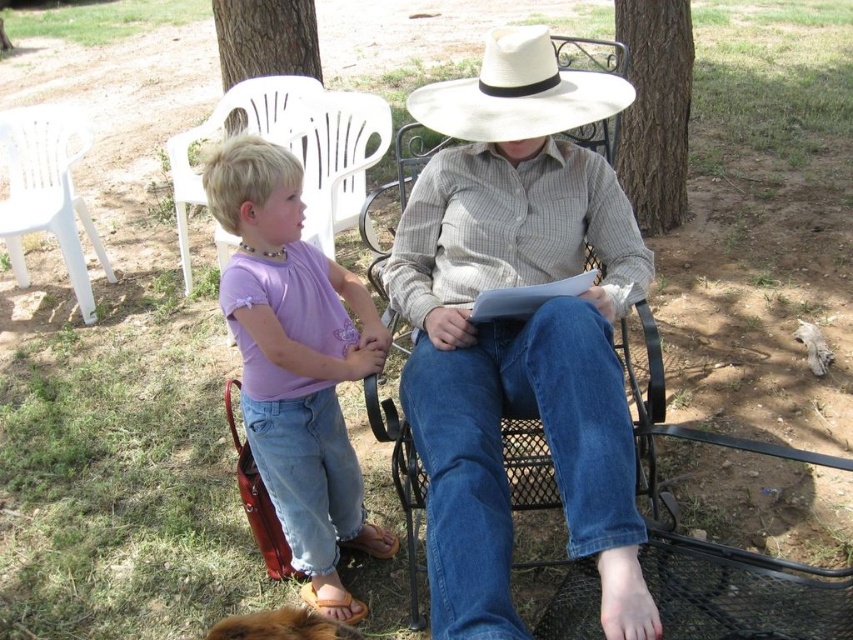
Based on the photo, you are standing at the edge of the scene and want to hand a drink to the person wearing the matte brown shirt at center. Which direction should you move relative to the white plastic chair at lower left?

The matte brown shirt at center is to the right of the white plastic chair at lower left, so you should move to the right of the white plastic chair at lower left to reach the matte brown shirt at center.

You are a photographer trying to capture a candid shot of the purple cotton shirt at left and the white plastic chair at lower left. Which object should you focus on first to ensure it appears larger in your photo?

The purple cotton shirt at left is closer to the viewer than the white plastic chair at lower left, so focusing on it first will make it appear larger in the photo.